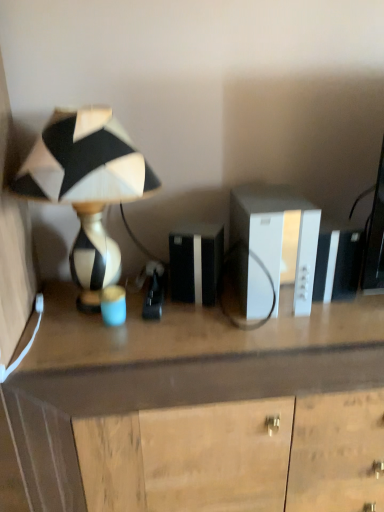
Question: Is white plastic cabinet at center directly adjacent to black and white ceramic lamp at left?

Choices:
 (A) yes
 (B) no

Answer: (B)

Question: Can you confirm if white plastic cabinet at center is shorter than black and white ceramic lamp at left?

Choices:
 (A) yes
 (B) no

Answer: (A)

Question: Is white plastic cabinet at center closer to camera compared to black and white ceramic lamp at left?

Choices:
 (A) yes
 (B) no

Answer: (B)

Question: Considering the relative sizes of white plastic cabinet at center and black and white ceramic lamp at left in the image provided, is white plastic cabinet at center smaller than black and white ceramic lamp at left?

Choices:
 (A) no
 (B) yes

Answer: (B)

Question: From the image's perspective, does white plastic cabinet at center appear lower than black and white ceramic lamp at left?

Choices:
 (A) no
 (B) yes

Answer: (B)

Question: Is white plastic cabinet at center bigger than black and white ceramic lamp at left?

Choices:
 (A) no
 (B) yes

Answer: (A)

Question: Is wooden desk at center aimed at white plastic cabinet at center?

Choices:
 (A) no
 (B) yes

Answer: (A)

Question: Does wooden desk at center have a larger size compared to white plastic cabinet at center?

Choices:
 (A) no
 (B) yes

Answer: (B)

Question: From the image's perspective, is wooden desk at center on top of white plastic cabinet at center?

Choices:
 (A) no
 (B) yes

Answer: (A)

Question: Can we say wooden desk at center lies outside white plastic cabinet at center?

Choices:
 (A) yes
 (B) no

Answer: (A)

Question: From a real-world perspective, is wooden desk at center on white plastic cabinet at center?

Choices:
 (A) yes
 (B) no

Answer: (B)

Question: Is wooden desk at center at the left side of white plastic cabinet at center?

Choices:
 (A) no
 (B) yes

Answer: (B)

Question: From the image's perspective, is black and white ceramic lamp at left located beneath wooden desk at center?

Choices:
 (A) no
 (B) yes

Answer: (A)